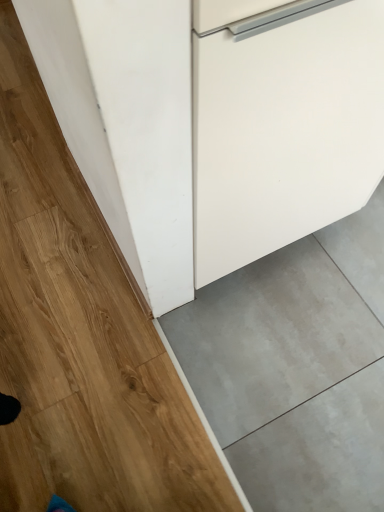
Image resolution: width=384 pixels, height=512 pixels. Describe the element at coordinates (80, 337) in the screenshot. I see `wooden floor at lower left` at that location.

The height and width of the screenshot is (512, 384). I want to click on wooden floor at lower left, so click(80, 337).

Where is `wooden floor at lower left`? wooden floor at lower left is located at coordinates (80, 337).